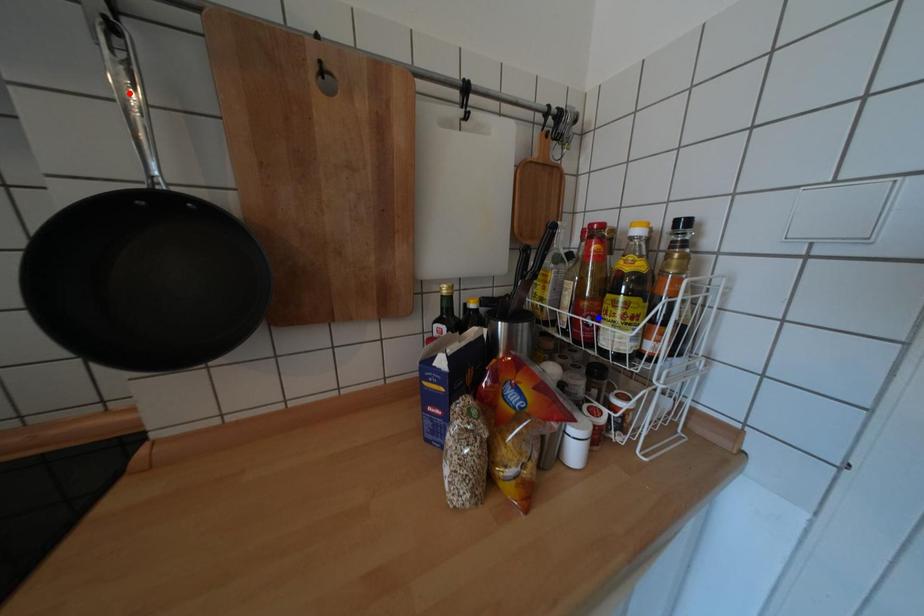
Question: In the image, two points are highlighted. Which point is nearer to the camera? Reply with the corresponding letter.

Choices:
 (A) blue point
 (B) red point

Answer: (B)